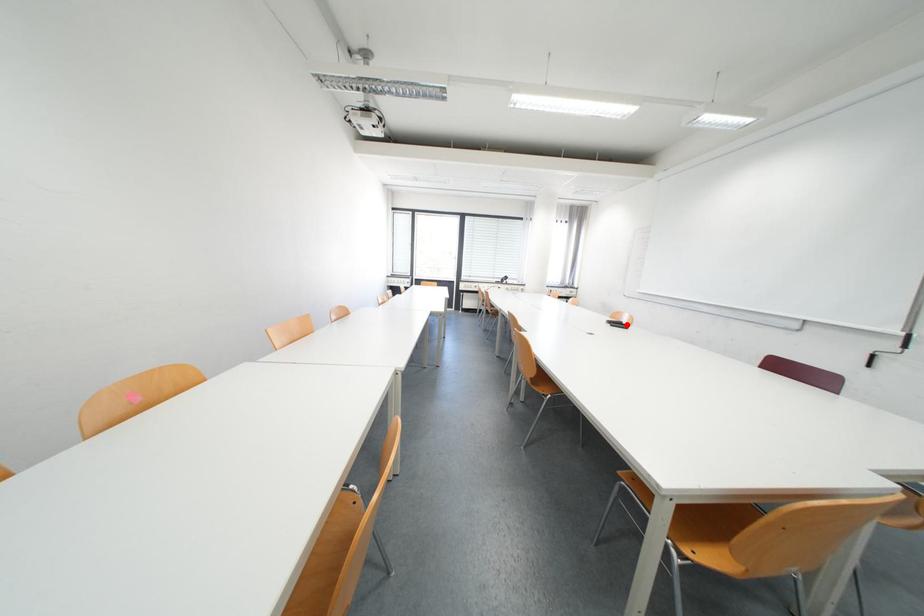
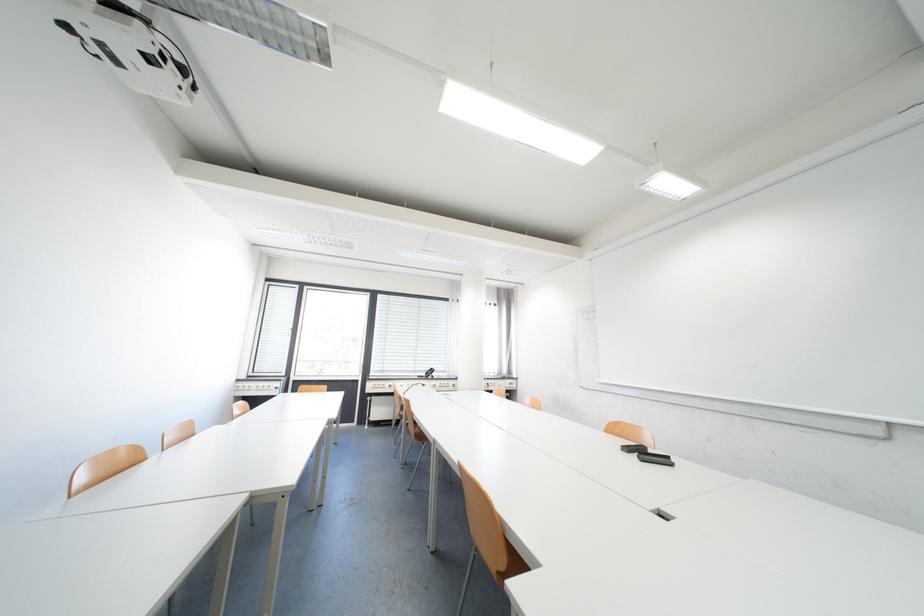
The point at the highlighted location is marked in the first image. Where is the corresponding point in the second image?

(652, 454)